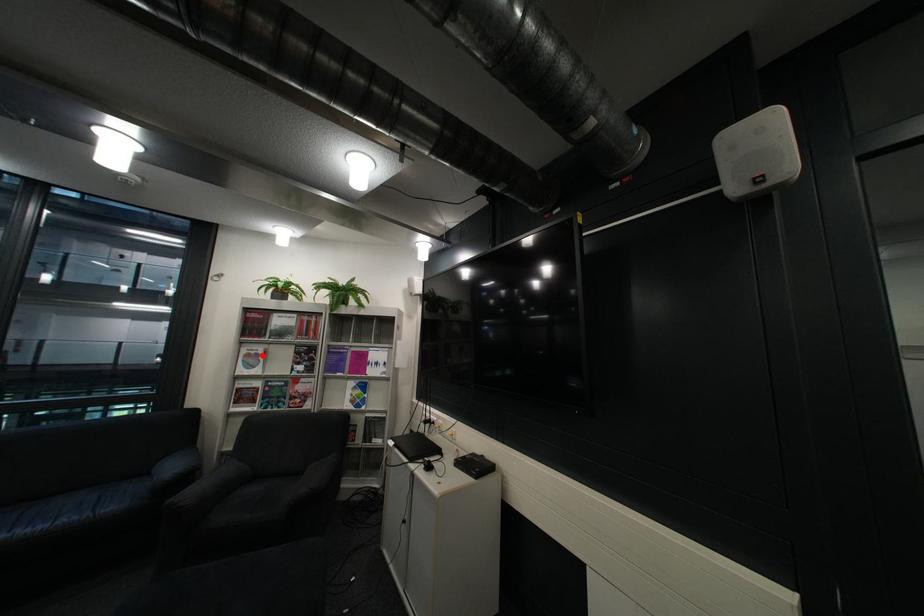
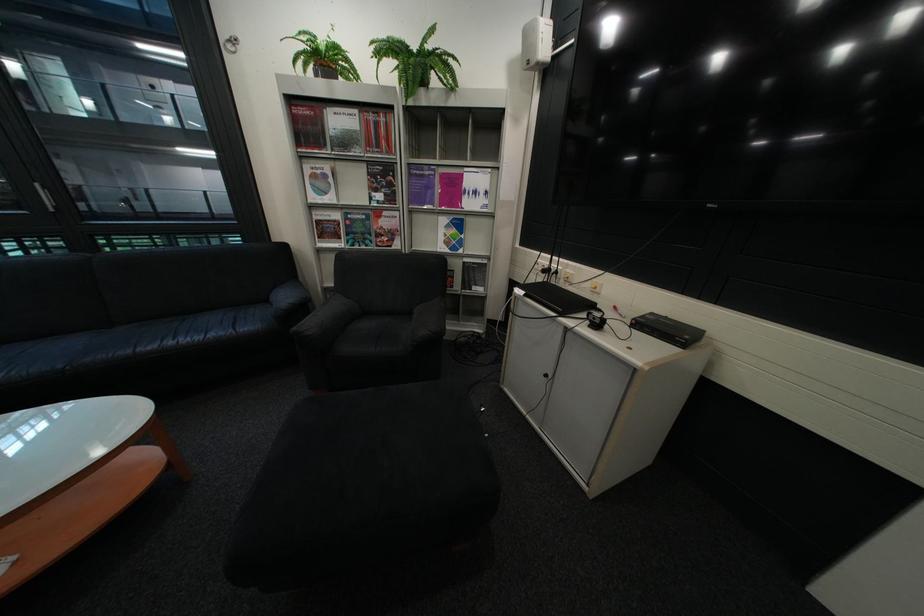
Where in the second image is the point corresponding to the highlighted location from the first image?

(329, 177)